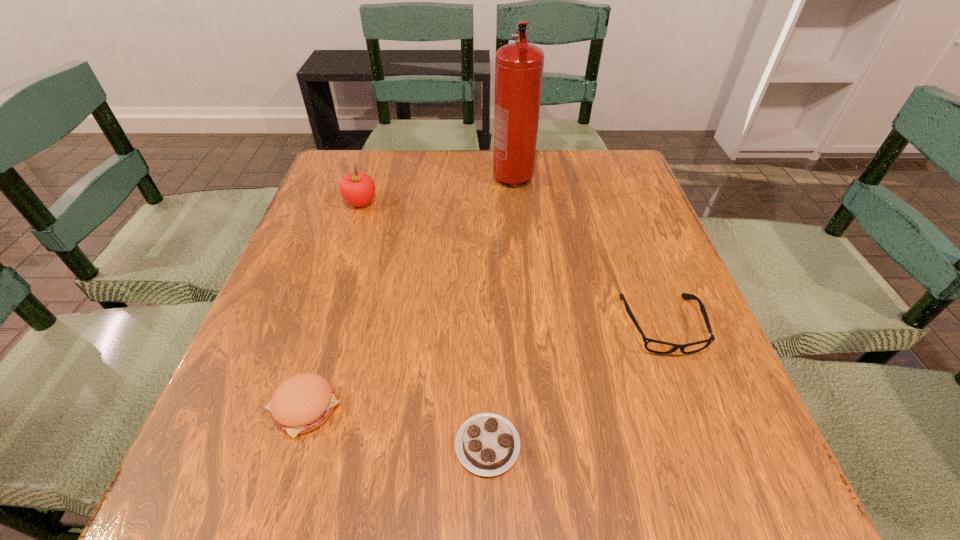
This screenshot has height=540, width=960. In order to click on free space that is in between the rightmost object and the shortest object in this screenshot , I will do `click(575, 386)`.

At what (x,y) coordinates should I click in order to perform the action: click on free space between the spectacles and the apple. Please return your answer as a coordinate pair (x, y). Looking at the image, I should click on (511, 264).

Find the location of a particular element. free spot between the tallest object and the fourth shortest object is located at coordinates (437, 191).

At what (x,y) coordinates should I click in order to perform the action: click on free point between the shortest object and the patty. Please return your answer as a coordinate pair (x, y). Looking at the image, I should click on (396, 427).

Identify which object is the fourth closest to the tallest object. Please provide its 2D coordinates. Your answer should be formatted as a tuple, i.e. [(x, y)], where the tuple contains the x and y coordinates of a point satisfying the conditions above.

[(487, 444)]

What are the coordinates of `the second closest object to the patty` in the screenshot? It's located at (358, 189).

The width and height of the screenshot is (960, 540). I want to click on vacant position in the image that satisfies the following two spatial constraints: 1. on the front side of the fourth shortest object; 2. on the right side of the patty, so click(x=294, y=408).

The width and height of the screenshot is (960, 540). In order to click on vacant space that satisfies the following two spatial constraints: 1. on the front side of the chocolate cake; 2. on the right side of the apple in this screenshot , I will do `click(281, 446)`.